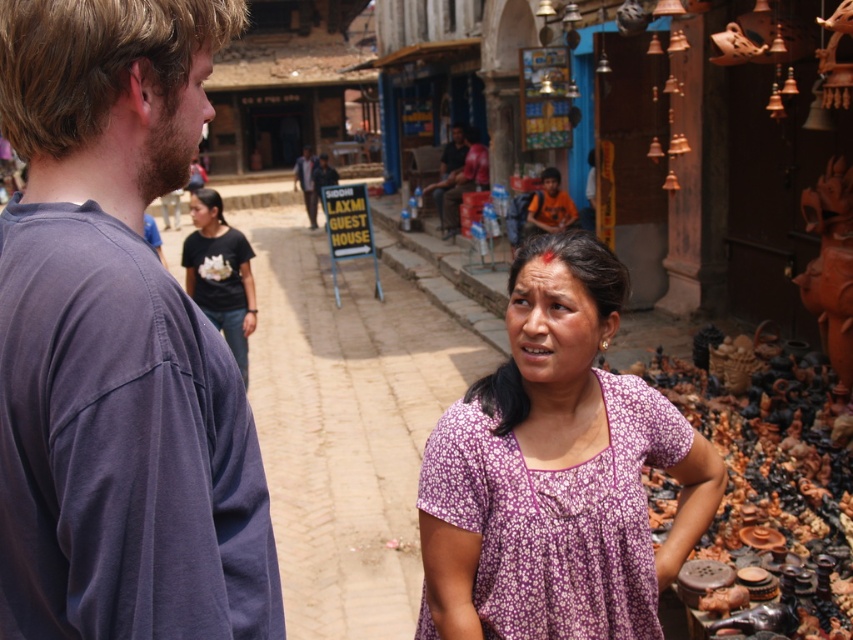
Question: In this image, where is dark blue t-shirt at left located relative to matte black signboard at center?

Choices:
 (A) left
 (B) right

Answer: (B)

Question: Which of the following is the farthest from the observer?

Choices:
 (A) [225, 435]
 (B) [308, 196]

Answer: (B)

Question: Which point appears farthest from the camera in this image?

Choices:
 (A) (311, 198)
 (B) (239, 596)
 (C) (474, 605)

Answer: (A)

Question: Is dark blue t-shirt at left smaller than purple floral dress at center?

Choices:
 (A) no
 (B) yes

Answer: (B)

Question: Is dark blue t-shirt at left smaller than purple floral dress at center?

Choices:
 (A) yes
 (B) no

Answer: (A)

Question: Which point appears closest to the camera in this image?

Choices:
 (A) (88, 554)
 (B) (326, 161)

Answer: (A)